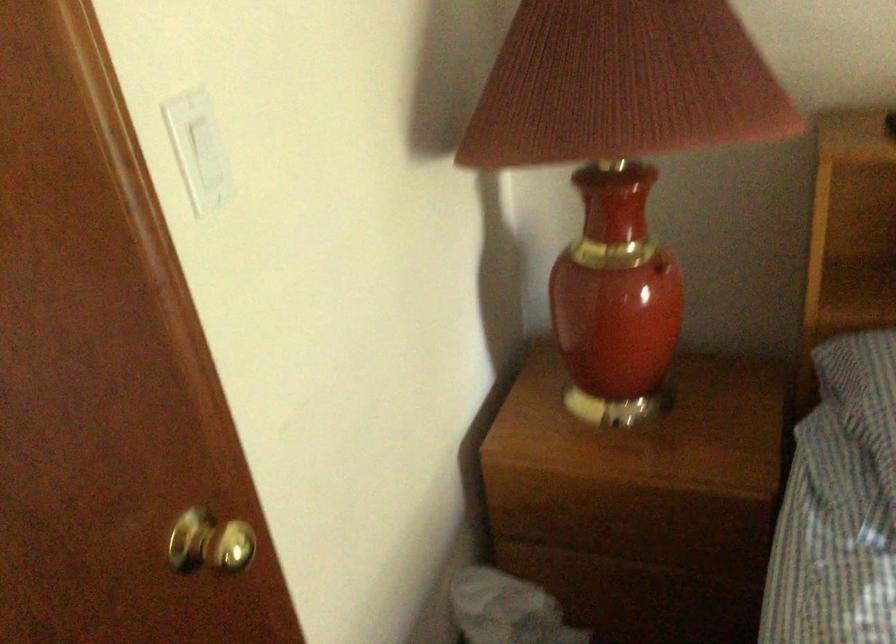
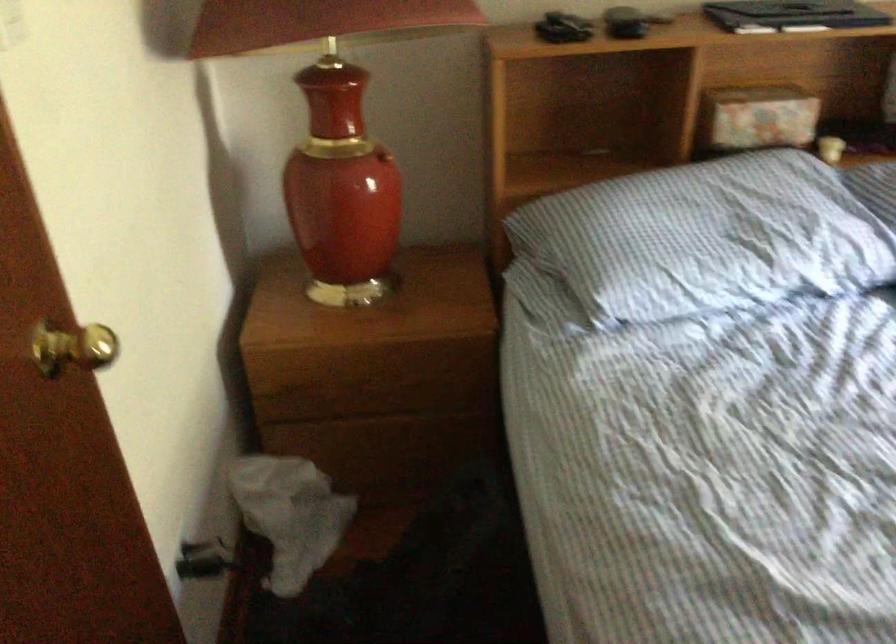
Which direction would the cameraman need to move to produce the second image?

The cameraman walked toward left, backward.